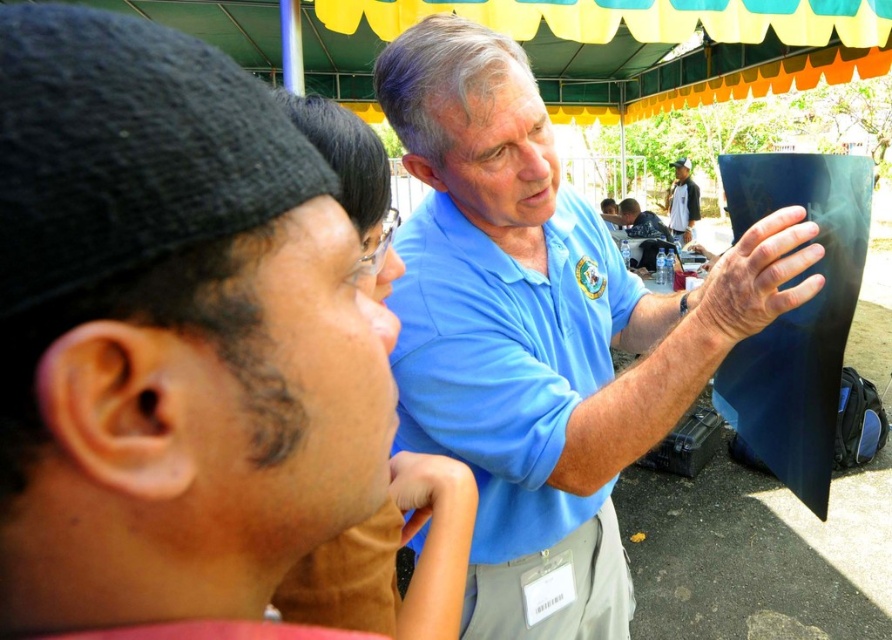
Question: Estimate the real-world distances between objects in this image. Which object is farther from the blue cotton polo shirt at center?

Choices:
 (A) blue matte shirt at upper center
 (B) blue matte shirt at center
 (C) white cotton shirt at upper center
 (D) matte blue shirt at center

Answer: (C)

Question: Which is farther from the blue matte shirt at center?

Choices:
 (A) blue cotton polo shirt at center
 (B) matte blue shirt at center

Answer: (B)

Question: Does blue matte shirt at upper center appear over blue matte shirt at center?

Choices:
 (A) no
 (B) yes

Answer: (B)

Question: Which of the following is the farthest from the observer?

Choices:
 (A) (478, 480)
 (B) (653, 234)

Answer: (B)

Question: Can you confirm if blue matte shirt at upper center is smaller than matte blue shirt at center?

Choices:
 (A) no
 (B) yes

Answer: (B)

Question: Can you confirm if blue matte shirt at upper center is wider than blue matte shirt at center?

Choices:
 (A) yes
 (B) no

Answer: (B)